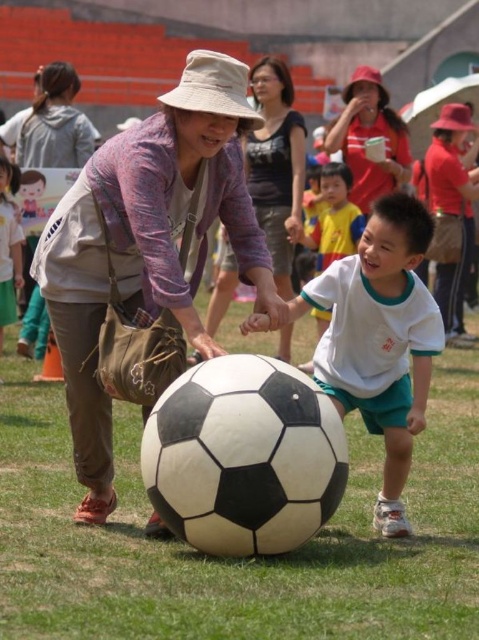
Which is in front, point (22, 150) or point (312, 227)?

Positioned in front is point (22, 150).

Which of these two, matte gray hoodie at upper left or white matte shirt at center, stands shorter?

With less height is matte gray hoodie at upper left.

Describe the element at coordinates (52, 124) in the screenshot. I see `matte gray hoodie at upper left` at that location.

Where is `matte gray hoodie at upper left`? Image resolution: width=479 pixels, height=640 pixels. matte gray hoodie at upper left is located at coordinates (52, 124).

Can you confirm if black matte soccer ball at center is positioned to the right of matte gray hoodie at upper left?

Indeed, black matte soccer ball at center is positioned on the right side of matte gray hoodie at upper left.

You are a GUI agent. You are given a task and a screenshot of the screen. Output one action in this format:
    pyautogui.click(x=<x>, y=<y>)
    Task: Click on the black matte soccer ball at center
    The height and width of the screenshot is (640, 479).
    Given the screenshot: What is the action you would take?
    pyautogui.click(x=148, y=243)

At what (x,y) coordinates should I click in order to perform the action: click on black matte soccer ball at center. Please return your answer as a coordinate pair (x, y). Looking at the image, I should click on (148, 243).

Is white matte soccer ball at center further to the viewer compared to white matte shirt at center?

No.

Is white matte soccer ball at center thinner than white matte shirt at center?

Incorrect, white matte soccer ball at center's width is not less than white matte shirt at center's.

Between point (408, 385) and point (326, 230), which one is positioned in front?

Point (408, 385)

I want to click on white matte soccer ball at center, so click(x=379, y=339).